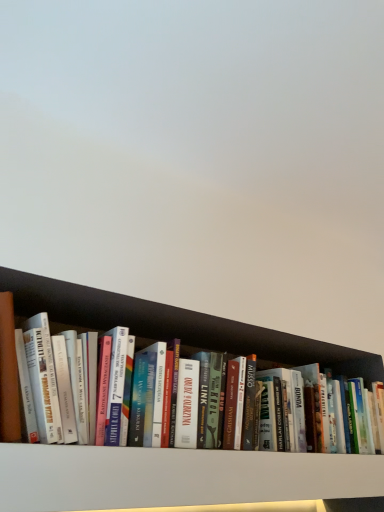
Question: Visually, is black wood shelf at lower center, which ranks as the 2th shelf in bottom-to-top order, positioned to the left or to the right of white matte bookshelf at center, the first shelf when ordered from bottom to top?

Choices:
 (A) left
 (B) right

Answer: (B)

Question: Considering the positions of point (134, 456) and point (210, 462), is point (134, 456) closer or farther from the camera than point (210, 462)?

Choices:
 (A) closer
 (B) farther

Answer: (A)

Question: From a real-world perspective, is black wood shelf at lower center, acting as the 1th shelf starting from the top, positioned above or below white matte bookshelf at center, which is the second shelf in top-to-bottom order?

Choices:
 (A) above
 (B) below

Answer: (A)

Question: From the image's perspective, is white matte bookshelf at center, the first shelf when ordered from bottom to top, positioned above or below black wood shelf at lower center, which ranks as the 2th shelf in bottom-to-top order?

Choices:
 (A) above
 (B) below

Answer: (B)

Question: From a real-world perspective, is white matte bookshelf at center, the first shelf when ordered from bottom to top, physically located above or below black wood shelf at lower center, which ranks as the 2th shelf in bottom-to-top order?

Choices:
 (A) above
 (B) below

Answer: (B)

Question: Is white matte bookshelf at center, which is the second shelf in top-to-bottom order, bigger or smaller than black wood shelf at lower center, acting as the 1th shelf starting from the top?

Choices:
 (A) big
 (B) small

Answer: (B)

Question: Is point (153, 453) closer or farther from the camera than point (51, 492)?

Choices:
 (A) farther
 (B) closer

Answer: (A)